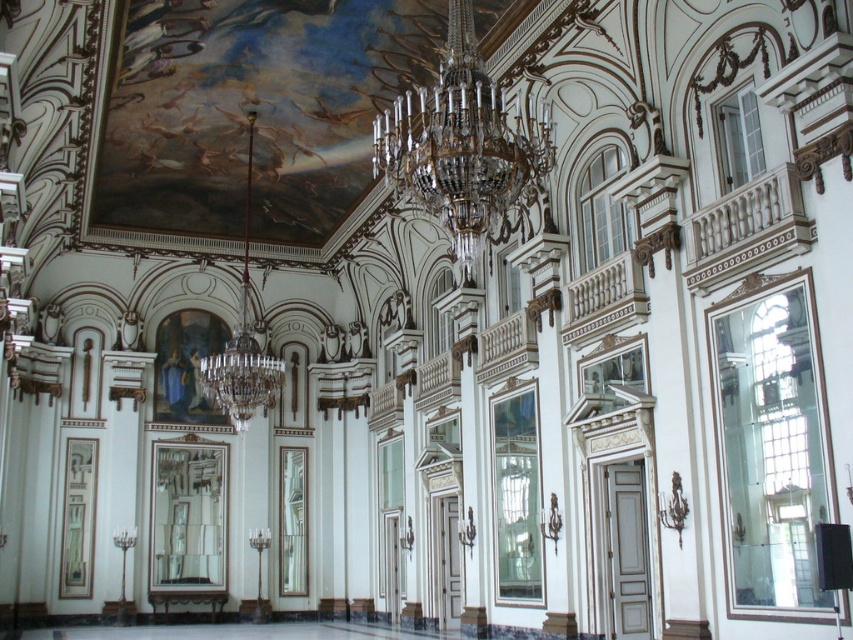
Question: Does crystal/golden chandelier at center appear over crystal glass chandelier at center?

Choices:
 (A) no
 (B) yes

Answer: (B)

Question: Can you confirm if crystal/golden chandelier at center is thinner than crystal glass chandelier at center?

Choices:
 (A) no
 (B) yes

Answer: (B)

Question: Considering the relative positions of crystal/golden chandelier at center and crystal glass chandelier at center in the image provided, where is crystal/golden chandelier at center located with respect to crystal glass chandelier at center?

Choices:
 (A) above
 (B) below

Answer: (A)